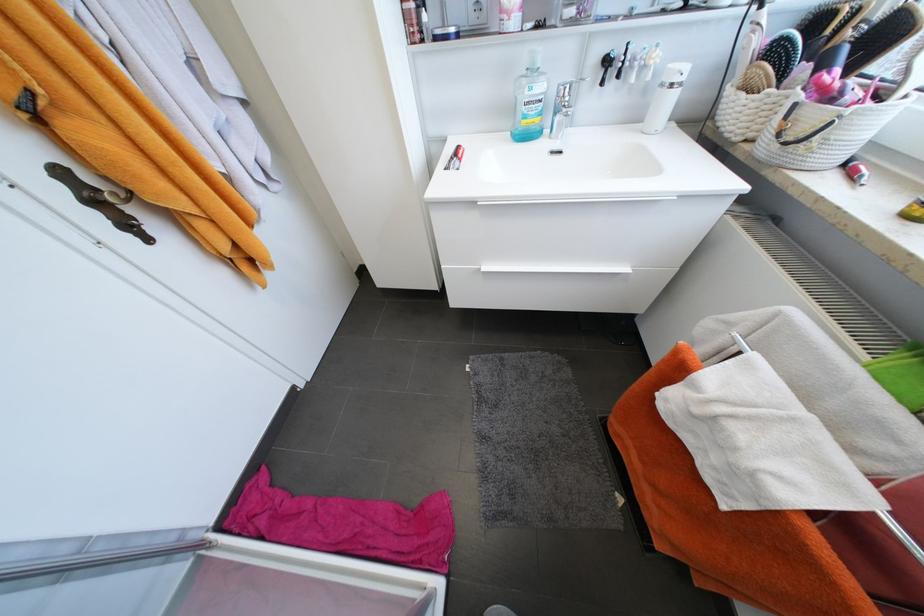
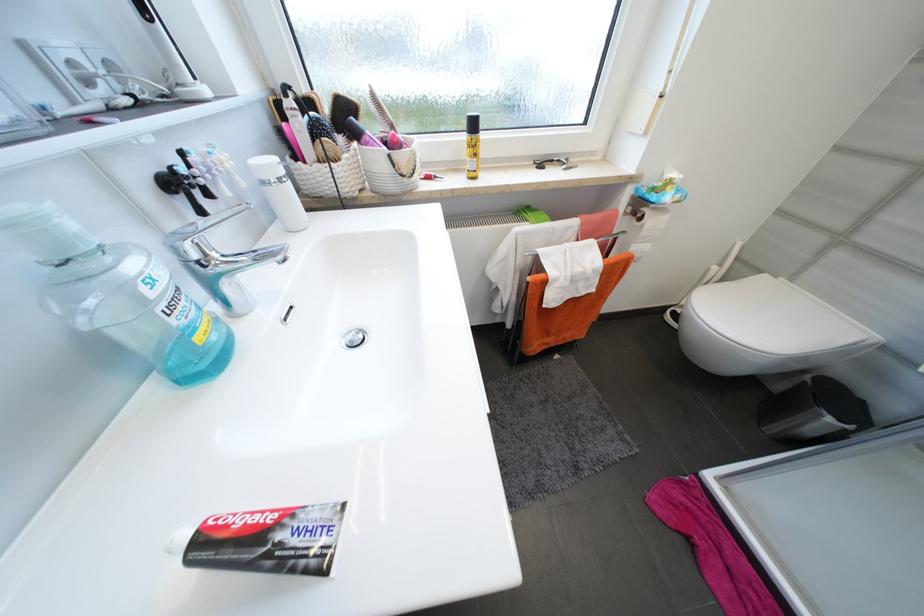
Find the pixel in the second image that matches (x=375, y=533) in the first image.

(759, 596)